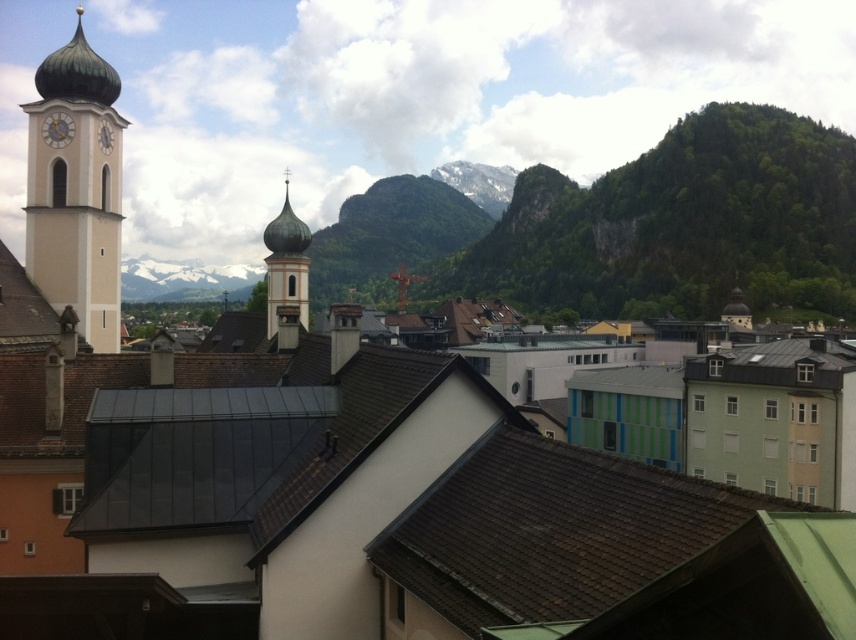
Question: Which point is closer to the camera?

Choices:
 (A) (473, 634)
 (B) (70, 214)

Answer: (A)

Question: Which is nearer to the green copper dome at center?

Choices:
 (A) brown shingles at center
 (B) white stucco bell tower at left

Answer: (B)

Question: Considering the relative positions of brown shingles at center and white stucco bell tower at left in the image provided, where is brown shingles at center located with respect to white stucco bell tower at left?

Choices:
 (A) left
 (B) right

Answer: (B)

Question: Estimate the real-world distances between objects in this image. Which object is farther from the brown shingles at center?

Choices:
 (A) white stucco bell tower at left
 (B) green copper dome at center

Answer: (A)

Question: Considering the relative positions of brown shingles at center and white stucco bell tower at left in the image provided, where is brown shingles at center located with respect to white stucco bell tower at left?

Choices:
 (A) above
 (B) below

Answer: (B)

Question: Does white stucco bell tower at left appear on the left side of green copper dome at center?

Choices:
 (A) no
 (B) yes

Answer: (B)